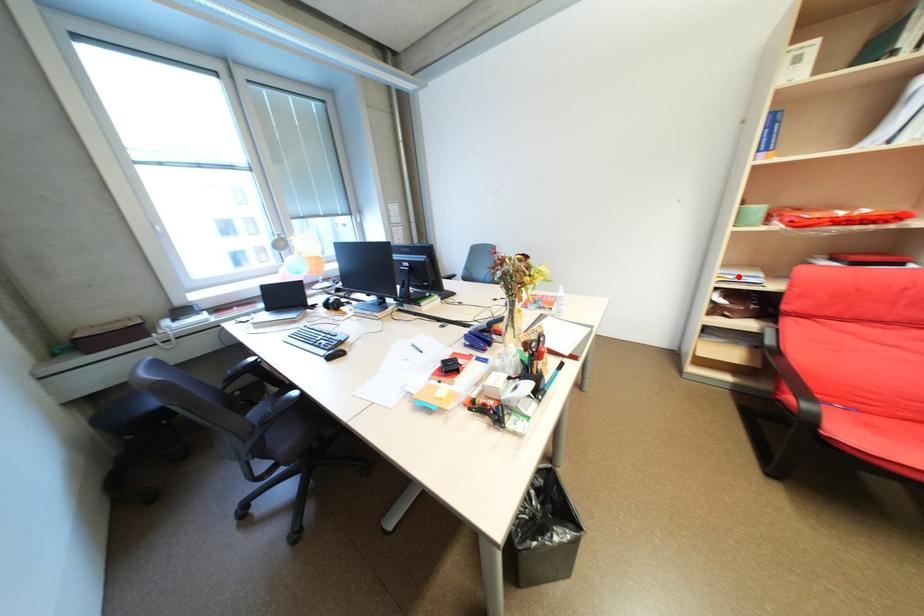
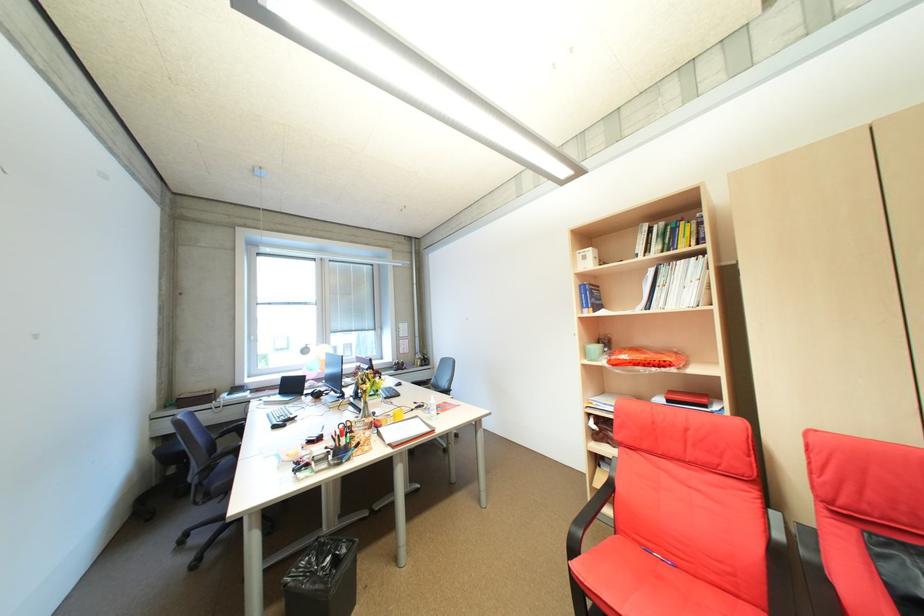
Where in the second image is the point corresponding to the highlighted location from the first image?

(603, 403)